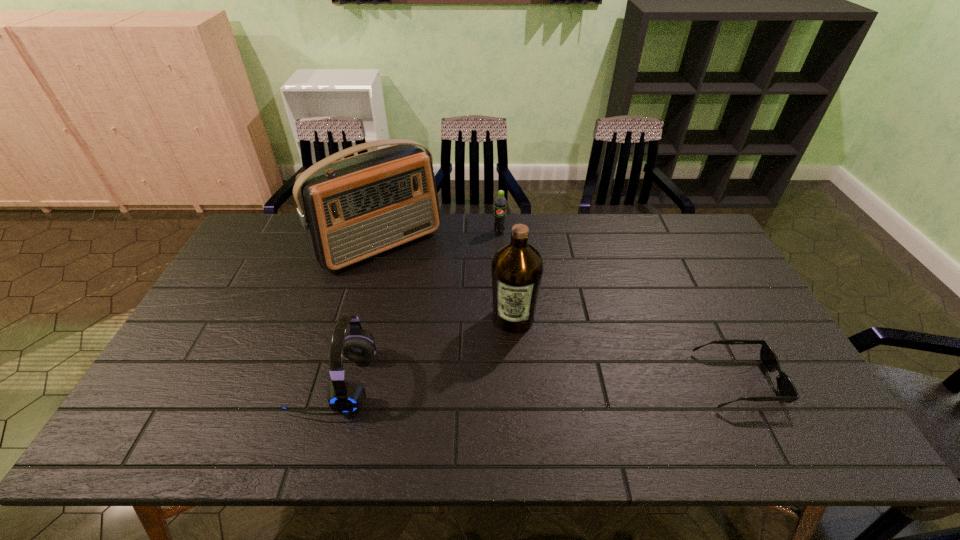
The width and height of the screenshot is (960, 540). I want to click on vacant space that satisfies the following two spatial constraints: 1. on the front side of the olive oil; 2. at the front lenses of the shortest object, so click(x=518, y=380).